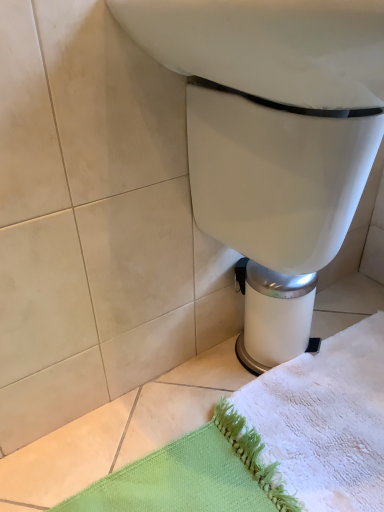
Describe the element at coordinates (326, 420) in the screenshot. The height and width of the screenshot is (512, 384). I see `white textured bath towel at lower right` at that location.

Identify the location of white textured bath towel at lower right. The width and height of the screenshot is (384, 512). (326, 420).

Where is `white glossy toilet at center`? The width and height of the screenshot is (384, 512). white glossy toilet at center is located at coordinates (273, 115).

In order to face white glossy toilet at center, should I rotate leftwards or rightwards?

To align with it, rotate right about 18.441°.

The image size is (384, 512). What do you see at coordinates (273, 115) in the screenshot? I see `white glossy toilet at center` at bounding box center [273, 115].

The width and height of the screenshot is (384, 512). In order to click on white textured bath towel at lower right in this screenshot , I will do `click(326, 420)`.

Based on the photo, considering the relative positions of white glossy toilet at center and white textured bath towel at lower right in the image provided, is white glossy toilet at center to the right of white textured bath towel at lower right from the viewer's perspective?

No, white glossy toilet at center is not to the right of white textured bath towel at lower right.

Is white glossy toilet at center positioned behind white textured bath towel at lower right?

No.

Between point (235, 230) and point (357, 508), which one is positioned behind?

The point (235, 230) is more distant.

Based on the photo, from the image's perspective, would you say white glossy toilet at center is shown under white textured bath towel at lower right?

A: Incorrect, from the image's perspective, white glossy toilet at center is higher than white textured bath towel at lower right.

From a real-world perspective, who is located higher, white glossy toilet at center or white textured bath towel at lower right?

From a 3D spatial view, white glossy toilet at center is above.

Is white glossy toilet at center thinner than white textured bath towel at lower right?

Correct, the width of white glossy toilet at center is less than that of white textured bath towel at lower right.

Is white glossy toilet at center taller or shorter than white textured bath towel at lower right?

In the image, white glossy toilet at center appears to be taller than white textured bath towel at lower right.

Looking at the image, does white glossy toilet at center seem bigger or smaller compared to white textured bath towel at lower right?

Clearly, white glossy toilet at center is larger in size than white textured bath towel at lower right.

Could white textured bath towel at lower right be considered to be inside white glossy toilet at center?

That's incorrect, white textured bath towel at lower right is not inside white glossy toilet at center.

Consider the image. Is white glossy toilet at center far away from white textured bath towel at lower right?

No.

Is white glossy toilet at center oriented towards white textured bath towel at lower right?

No.

Find the location of a particular element. The image size is (384, 512). bath towel behind the white glossy toilet at center is located at coordinates (326, 420).

Which object is positioned more to the right, white textured bath towel at lower right or white glossy toilet at center?

white textured bath towel at lower right is more to the right.

Does white textured bath towel at lower right come behind white glossy toilet at center?

Yes, the depth of white textured bath towel at lower right is greater than that of white glossy toilet at center.

Which is closer, [348,507] or [281,192]?

Point [348,507] is farther from the camera than point [281,192].

From the image's perspective, would you say white textured bath towel at lower right is shown under white glossy toilet at center?

Correct, white textured bath towel at lower right appears lower than white glossy toilet at center in the image.

Looking at this image, from a real-world perspective, which is physically above, white textured bath towel at lower right or white glossy toilet at center?

white glossy toilet at center is physically above.

Between white textured bath towel at lower right and white glossy toilet at center, which one has smaller width?

Thinner between the two is white glossy toilet at center.

Considering the relative sizes of white textured bath towel at lower right and white glossy toilet at center in the image provided, is white textured bath towel at lower right shorter than white glossy toilet at center?

Yes.

Considering the relative sizes of white textured bath towel at lower right and white glossy toilet at center in the image provided, is white textured bath towel at lower right smaller than white glossy toilet at center?

Yes.

Looking at this image, is white textured bath towel at lower right not inside white glossy toilet at center?

white textured bath towel at lower right lies outside white glossy toilet at center's area.

Would you consider white textured bath towel at lower right to be distant from white glossy toilet at center?

No.

Is white textured bath towel at lower right facing away from white glossy toilet at center?

No, white glossy toilet at center is not at the back of white textured bath towel at lower right.

Based on the photo, how many degrees apart are the facing directions of white textured bath towel at lower right and white glossy toilet at center?

90.4 degrees.

I want to click on toilet on the left side of white textured bath towel at lower right, so click(x=273, y=115).

At what (x,y) coordinates should I click in order to perform the action: click on toilet in front of the white textured bath towel at lower right. Please return your answer as a coordinate pair (x, y). The height and width of the screenshot is (512, 384). Looking at the image, I should click on (273, 115).

Locate an element on the screen. toilet on the left of white textured bath towel at lower right is located at coordinates (273, 115).